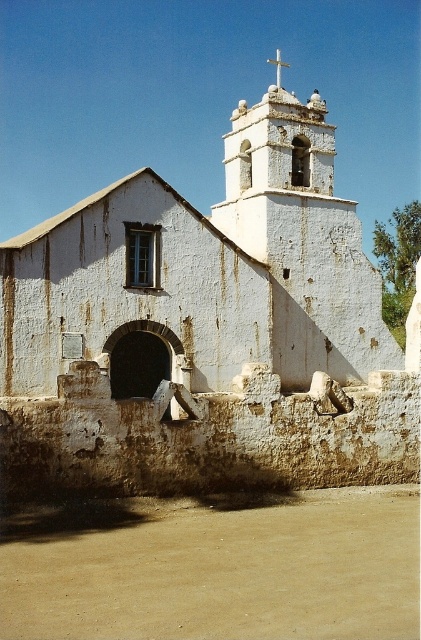
Question: Which point appears closest to the camera in this image?

Choices:
 (A) (234, 349)
 (B) (2, 588)
 (C) (282, 61)

Answer: (B)

Question: Does white plaster church at center come behind brown sandy dirt at lower center?

Choices:
 (A) no
 (B) yes

Answer: (B)

Question: Can you confirm if white plaster church at center is positioned to the right of white stone cross at upper center?

Choices:
 (A) no
 (B) yes

Answer: (A)

Question: Can you confirm if white plaster church at center is positioned to the left of white stone cross at upper center?

Choices:
 (A) yes
 (B) no

Answer: (A)

Question: Which is nearer to the white plaster church at center?

Choices:
 (A) white stone cross at upper center
 (B) brown sandy dirt at lower center

Answer: (B)

Question: Which object is positioned farthest from the brown sandy dirt at lower center?

Choices:
 (A) white stone cross at upper center
 (B) white plaster church at center

Answer: (A)